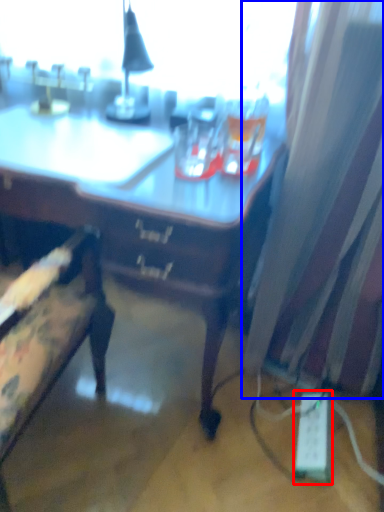
Question: Which object is closer to the camera taking this photo, extension cord (highlighted by a red box) or curtain (highlighted by a blue box)?

Choices:
 (A) extension cord
 (B) curtain

Answer: (B)